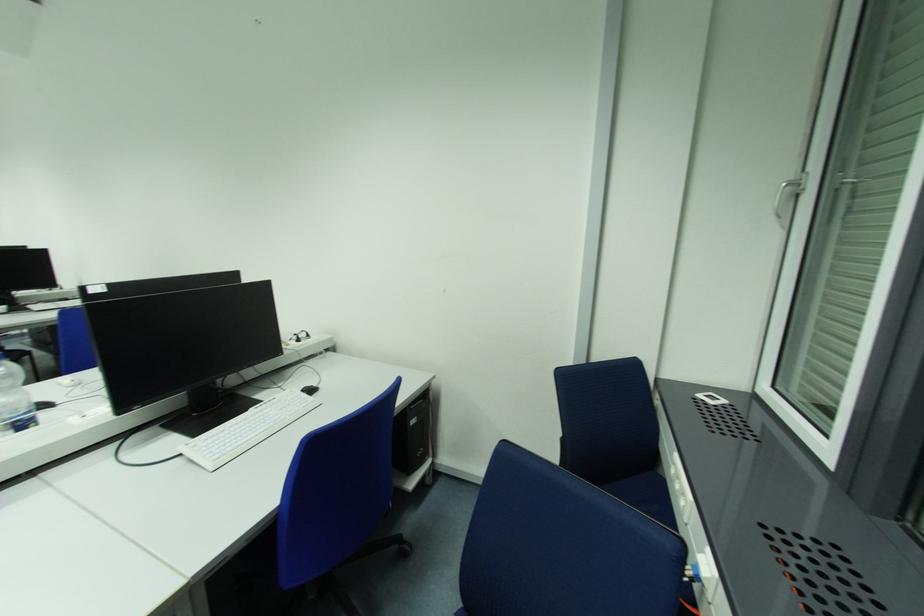
The location [310,389] corresponds to which object?

This point indicates the white computer mouse.